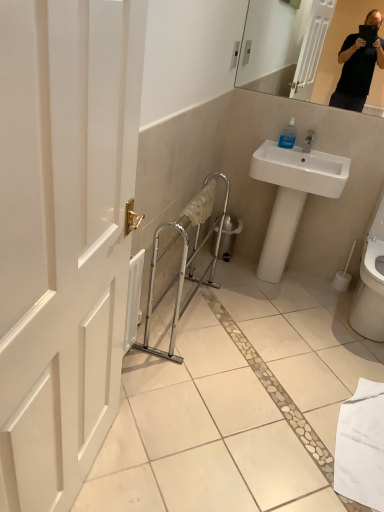
Question: Does white glossy sink at upper right have a greater height compared to white glossy toilet at lower right?

Choices:
 (A) no
 (B) yes

Answer: (B)

Question: Is white glossy sink at upper right positioned far away from white glossy toilet at lower right?

Choices:
 (A) no
 (B) yes

Answer: (A)

Question: Considering the relative positions of white glossy sink at upper right and white glossy toilet at lower right in the image provided, is white glossy sink at upper right to the right of white glossy toilet at lower right from the viewer's perspective?

Choices:
 (A) no
 (B) yes

Answer: (A)

Question: Would you say white glossy toilet at lower right is part of white glossy sink at upper right's contents?

Choices:
 (A) yes
 (B) no

Answer: (B)

Question: Is white glossy sink at upper right closer to camera compared to white glossy toilet at lower right?

Choices:
 (A) no
 (B) yes

Answer: (A)

Question: Is white glossy sink at upper right not inside white glossy toilet at lower right?

Choices:
 (A) yes
 (B) no

Answer: (A)

Question: Is transparent plastic soap dispenser at upper right in front of white matte toilet paper at lower right?

Choices:
 (A) no
 (B) yes

Answer: (B)

Question: Is transparent plastic soap dispenser at upper right beside white matte toilet paper at lower right?

Choices:
 (A) no
 (B) yes

Answer: (A)

Question: From the image's perspective, is transparent plastic soap dispenser at upper right under white matte toilet paper at lower right?

Choices:
 (A) no
 (B) yes

Answer: (A)

Question: Can you confirm if transparent plastic soap dispenser at upper right is bigger than white matte toilet paper at lower right?

Choices:
 (A) yes
 (B) no

Answer: (B)

Question: Is transparent plastic soap dispenser at upper right positioned with its back to white matte toilet paper at lower right?

Choices:
 (A) yes
 (B) no

Answer: (B)

Question: Considering the relative sizes of transparent plastic soap dispenser at upper right and white matte toilet paper at lower right in the image provided, is transparent plastic soap dispenser at upper right wider than white matte toilet paper at lower right?

Choices:
 (A) no
 (B) yes

Answer: (A)

Question: Are transparent plastic soap dispenser at upper right and white glossy sink at upper right beside each other?

Choices:
 (A) no
 (B) yes

Answer: (A)